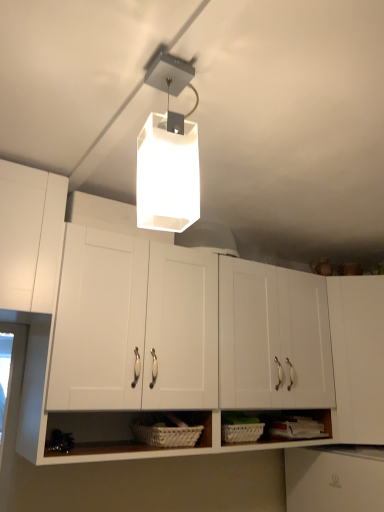
Question: In which direction should I rotate to look at white matte cabinet at center, placed as the 1th cabinetry when sorted from left to right?

Choices:
 (A) left
 (B) right

Answer: (B)

Question: Is white matte cabinet at center, the second cabinetry viewed from the right, at the left side of white matte rectangular light fixture at upper center?

Choices:
 (A) yes
 (B) no

Answer: (B)

Question: Is white matte cabinet at center, placed as the 1th cabinetry when sorted from left to right, at the right side of white matte rectangular light fixture at upper center?

Choices:
 (A) yes
 (B) no

Answer: (A)

Question: From the image's perspective, would you say white matte cabinet at center, the second cabinetry viewed from the right, is positioned over white matte rectangular light fixture at upper center?

Choices:
 (A) yes
 (B) no

Answer: (B)

Question: Does white matte cabinet at center, the second cabinetry viewed from the right, have a lesser width compared to white matte rectangular light fixture at upper center?

Choices:
 (A) no
 (B) yes

Answer: (A)

Question: Is white matte cabinet at center, placed as the 1th cabinetry when sorted from left to right, not near white matte rectangular light fixture at upper center?

Choices:
 (A) yes
 (B) no

Answer: (B)

Question: Is white matte cabinet at center, the second cabinetry viewed from the right, oriented towards white matte rectangular light fixture at upper center?

Choices:
 (A) yes
 (B) no

Answer: (A)

Question: Can you confirm if white matte cabinet at right, positioned as the 2th cabinetry in left-to-right order, is wider than white woven basket at lower center?

Choices:
 (A) yes
 (B) no

Answer: (A)

Question: Does white matte cabinet at right, marked as the 1th cabinetry in a right-to-left arrangement, turn towards white woven basket at lower center?

Choices:
 (A) no
 (B) yes

Answer: (A)

Question: Does white matte cabinet at right, positioned as the 2th cabinetry in left-to-right order, lie in front of white woven basket at lower center?

Choices:
 (A) no
 (B) yes

Answer: (A)

Question: Is white matte cabinet at right, marked as the 1th cabinetry in a right-to-left arrangement, positioned with its back to white woven basket at lower center?

Choices:
 (A) yes
 (B) no

Answer: (B)

Question: Is white woven basket at lower center located within white matte cabinet at right, positioned as the 2th cabinetry in left-to-right order?

Choices:
 (A) no
 (B) yes

Answer: (A)

Question: From a real-world perspective, is white matte cabinet at right, marked as the 1th cabinetry in a right-to-left arrangement, physically below white woven basket at lower center?

Choices:
 (A) no
 (B) yes

Answer: (A)

Question: From a real-world perspective, is white matte rectangular light fixture at upper center on top of white woven basket at lower center?

Choices:
 (A) yes
 (B) no

Answer: (A)